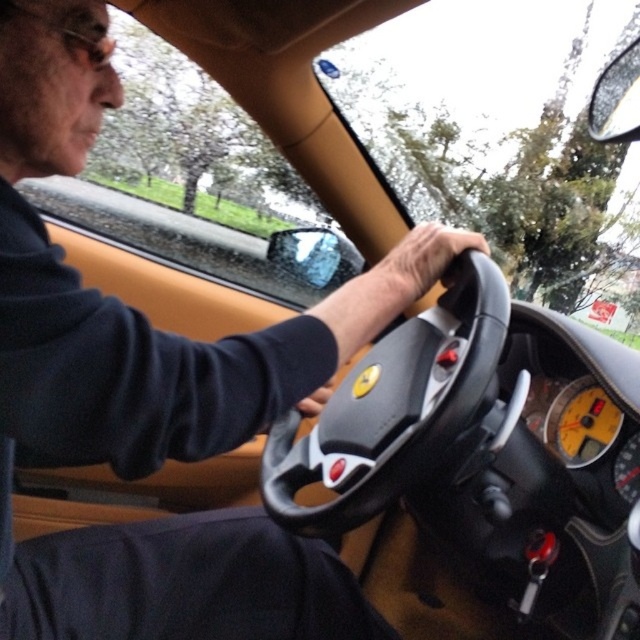
From the picture: Can you confirm if leather at center is positioned below leather at steering wheel center?

No, leather at center is not below leather at steering wheel center.

From the picture: Is leather at center to the left of leather at steering wheel center from the viewer's perspective?

No, leather at center is not to the left of leather at steering wheel center.

Does point (381, 308) come in front of point (321, 397)?

Yes, it is in front of point (321, 397).

Image resolution: width=640 pixels, height=640 pixels. I want to click on leather at center, so click(416, 264).

Can you confirm if leather/smooth steering wheel at center is positioned above leather at steering wheel center?

Correct, leather/smooth steering wheel at center is located above leather at steering wheel center.

Consider the image. Who is more forward, (433,356) or (332,387)?

Point (433,356) is more forward.

Locate an element on the screen. The height and width of the screenshot is (640, 640). leather/smooth steering wheel at center is located at coordinates (392, 406).

Who is more forward, (163,84) or (310,412)?

Point (310,412) is more forward.

Is transparent glass windshield at upper center positioned behind leather at steering wheel center?

Yes, it is behind leather at steering wheel center.

Is point (177, 260) behind point (317, 390)?

Yes, point (177, 260) is farther from viewer.

Find the location of a particular element. Image resolution: width=640 pixels, height=640 pixels. transparent glass windshield at upper center is located at coordinates (184, 173).